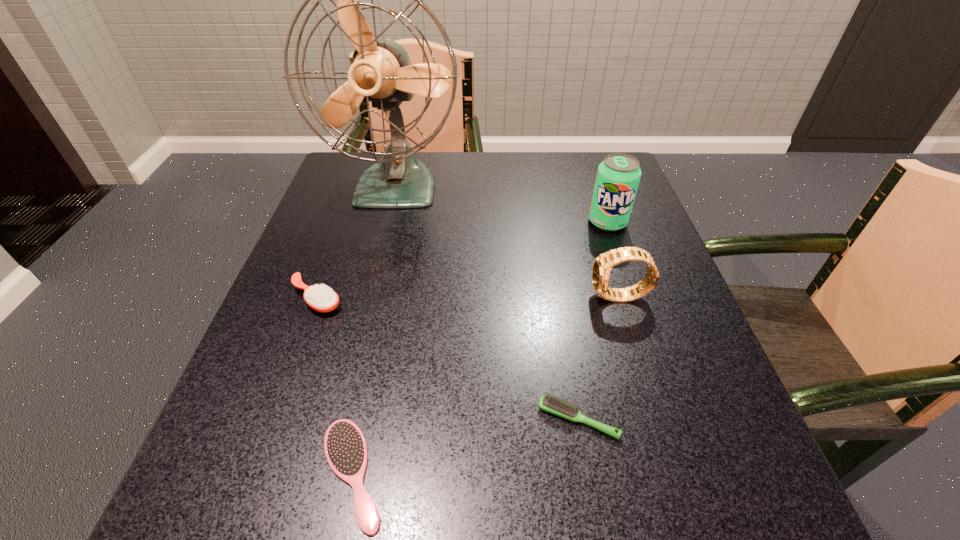
This screenshot has width=960, height=540. What are the coordinates of `the tallest object` in the screenshot? It's located at (381, 71).

Identify the location of pop soda. The width and height of the screenshot is (960, 540). (618, 176).

The width and height of the screenshot is (960, 540). I want to click on the third tallest object, so click(x=602, y=265).

Locate an element on the screen. This screenshot has width=960, height=540. the leftmost hairbrush is located at coordinates (321, 298).

Find the location of `the tallest hairbrush`. the tallest hairbrush is located at coordinates (321, 298).

Identify the location of the fourth object from left to right. (547, 403).

In order to click on the second hairbrush from left to right in this screenshot , I will do `click(345, 447)`.

In order to click on vacant space located 0.310m on the front-facing side of the fan for air flow in this screenshot , I will do `click(361, 335)`.

Identify the location of free space located 0.260m on the front-facing side of the fifth shortest object. (643, 326).

This screenshot has width=960, height=540. Identify the location of free point located 0.260m on the face of the watch. (453, 298).